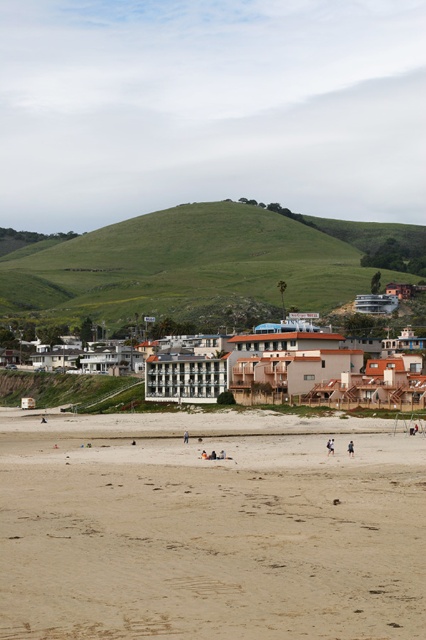
Can you confirm if green grassy hillside at upper center is smaller than light brown sand at center?

No.

Which is in front, point (34, 257) or point (351, 454)?

Positioned in front is point (351, 454).

Who is more distant from viewer, (8,308) or (348,451)?

The point (8,308) is more distant.

Find the location of a particular element. green grassy hillside at upper center is located at coordinates (196, 266).

Who is taller, white concrete building at center or light brown sand at center?

With more height is white concrete building at center.

Does point (154, 362) lie behind point (350, 442)?

Yes, point (154, 362) is farther from viewer.

Which is in front, point (189, 392) or point (353, 452)?

Point (353, 452) is more forward.

Image resolution: width=426 pixels, height=640 pixels. Identify the location of white concrete building at center. (184, 378).

Measure the distance between light tan sand at lower center and camera.

light tan sand at lower center and camera are 65.98 feet apart.

Can you confirm if light tan sand at lower center is positioned above white concrete building at center?

Actually, light tan sand at lower center is below white concrete building at center.

Image resolution: width=426 pixels, height=640 pixels. What are the coordinates of `light tan sand at lower center` in the screenshot? It's located at (210, 536).